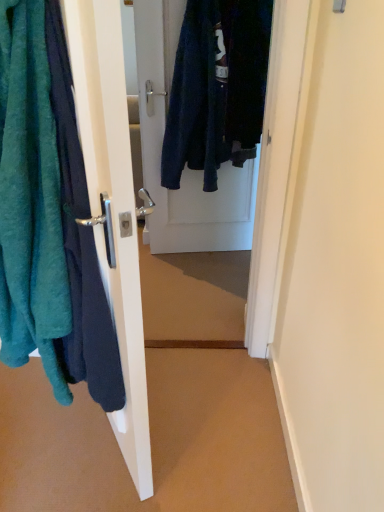
Question: Is teal fuzzy towel at left inside or outside of matte white door handle at left, the first door from the front?

Choices:
 (A) outside
 (B) inside

Answer: (A)

Question: In terms of height, does teal fuzzy towel at left look taller or shorter compared to matte white door handle at left, the 1th door positioned from the left?

Choices:
 (A) short
 (B) tall

Answer: (A)

Question: Based on their relative distances, which object is nearer to the velvet dark blue coat at center, marked as the first door in a right-to-left arrangement?

Choices:
 (A) matte white door handle at left, positioned as the second door in back-to-front order
 (B) teal fuzzy towel at left

Answer: (A)

Question: Which object is the closest to the teal fuzzy towel at left?

Choices:
 (A) velvet dark blue coat at center, acting as the 2th door starting from the front
 (B) matte white door handle at left, positioned as the second door in back-to-front order

Answer: (B)